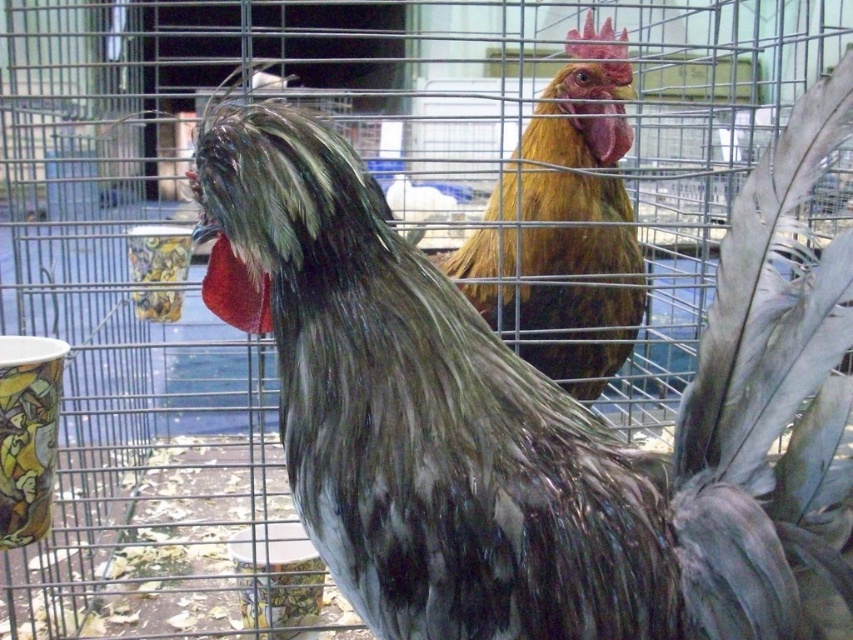
Which is more to the left, silvery-gray feathers at center or golden brown feathers at center?

silvery-gray feathers at center is more to the left.

Between silvery-gray feathers at center and golden brown feathers at center, which one appears on the right side from the viewer's perspective?

golden brown feathers at center is more to the right.

Is point (376, 385) in front of point (495, 236)?

Yes.

At what (x,y) coordinates should I click in order to perform the action: click on silvery-gray feathers at center. Please return your answer as a coordinate pair (x, y). The image size is (853, 640). Looking at the image, I should click on (534, 412).